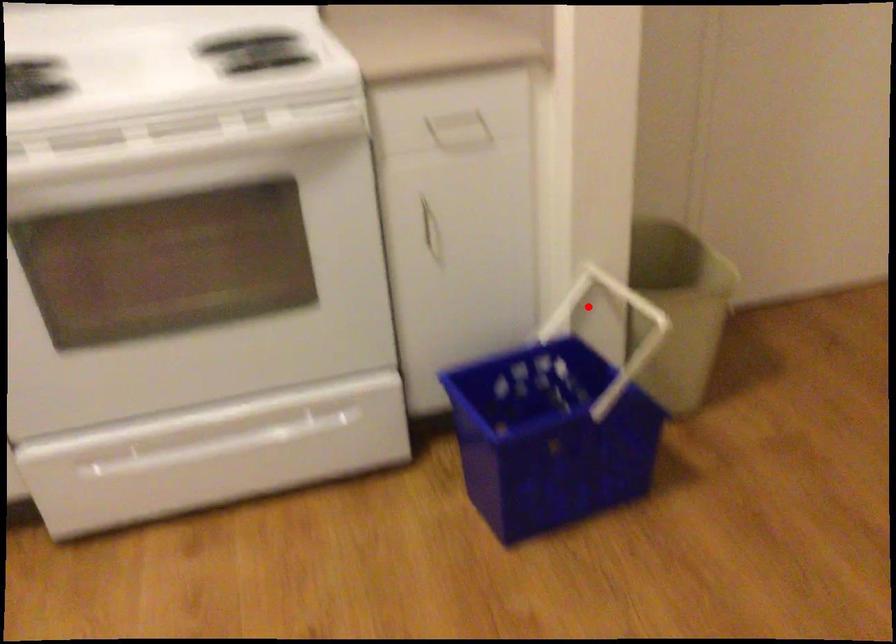
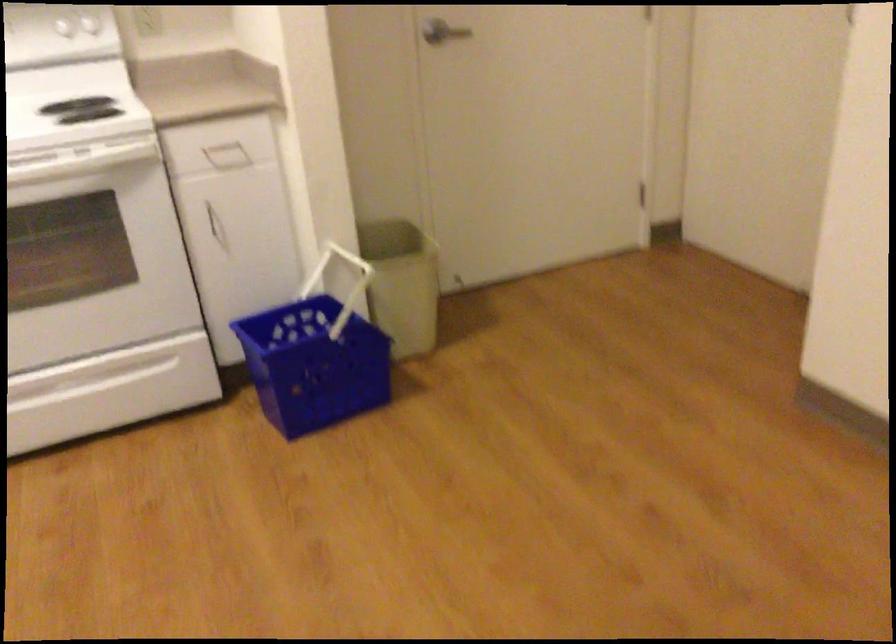
Question: I am providing you with two images of the same scene from different viewpoints. Image1 has a red point marked. In image2, the corresponding 3D location appears at what relative position? Reply with the corresponding letter.

Choices:
 (A) Closer
 (B) Farther

Answer: (B)